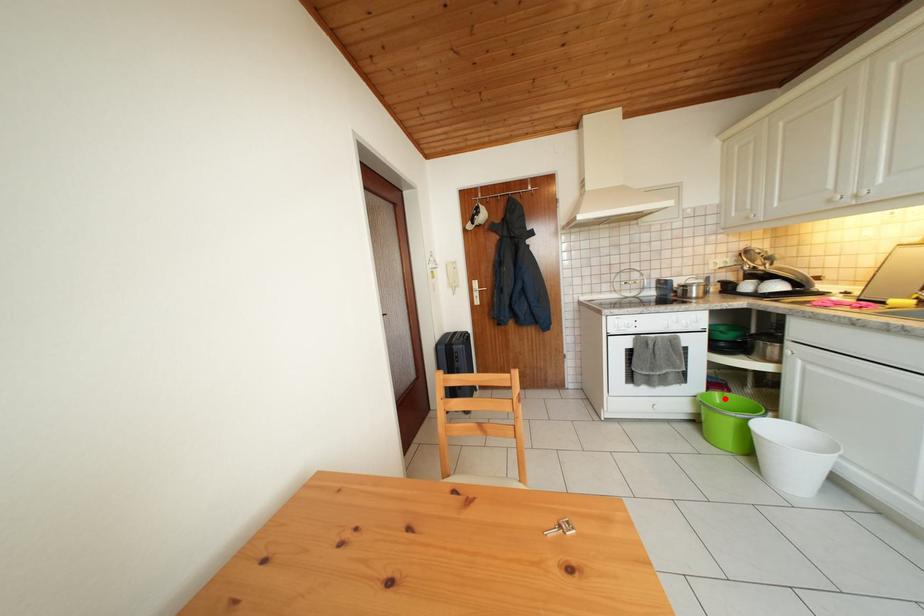
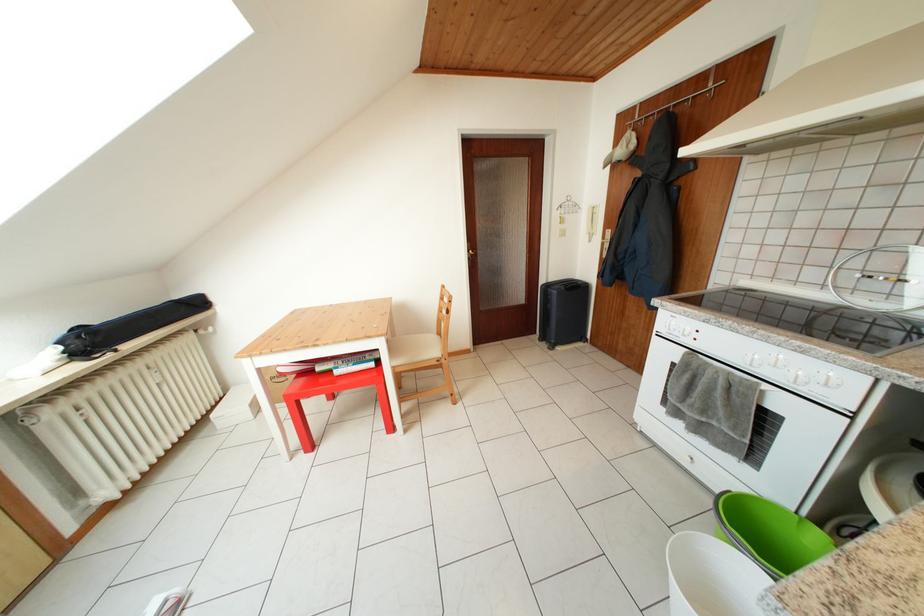
Locate, in the second image, the point that corresponds to the highlighted location in the first image.

(828, 540)